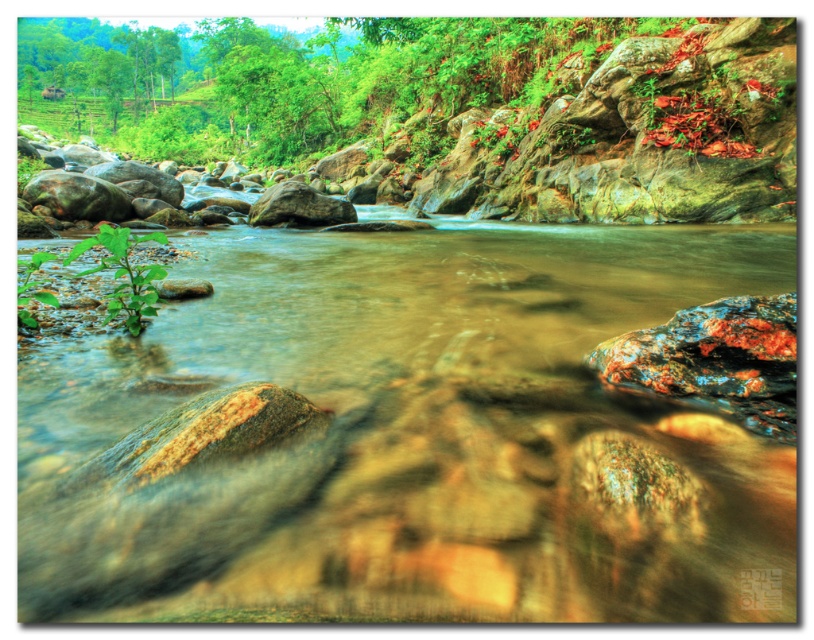
Question: Does green leafy plant at left appear on the left side of green leafy plant at lower left?

Choices:
 (A) yes
 (B) no

Answer: (B)

Question: In this image, where is green leafy plant at left located relative to green leafy plant at lower left?

Choices:
 (A) left
 (B) right

Answer: (B)

Question: Does green leafy plant at left have a greater width compared to green leafy plant at lower left?

Choices:
 (A) yes
 (B) no

Answer: (B)

Question: Which object appears farthest from the camera in this image?

Choices:
 (A) green leafy plant at lower left
 (B) green leafy plant at left

Answer: (A)

Question: Which of the following is the farthest from the observer?

Choices:
 (A) green leafy plant at left
 (B) green leafy plant at lower left

Answer: (B)

Question: Which of the following is the closest to the observer?

Choices:
 (A) (20, 316)
 (B) (152, 232)

Answer: (A)